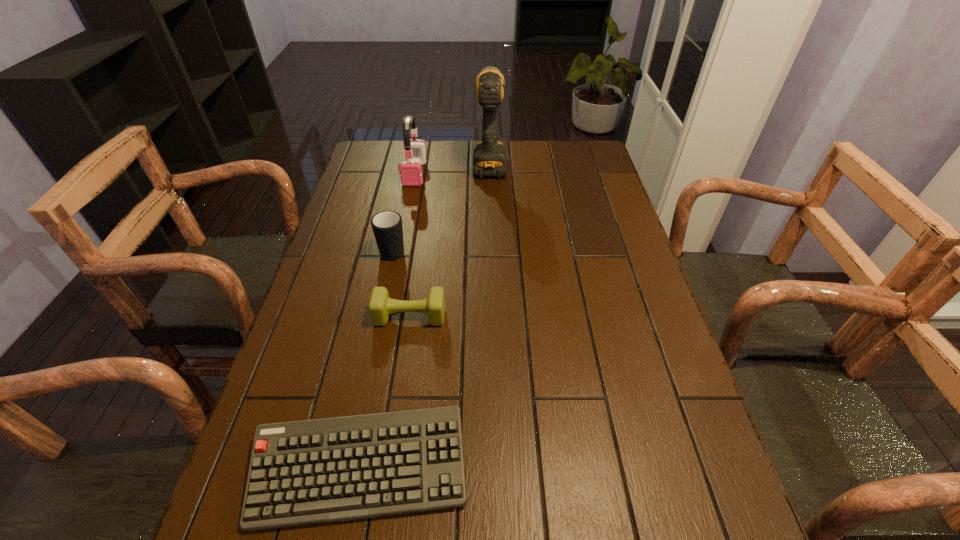
Locate an element on the screen. free space located on the side of the mug with the handle is located at coordinates (411, 165).

The image size is (960, 540). Identify the location of free spot located 0.320m on the side of the mug with the handle. (408, 177).

The image size is (960, 540). I want to click on vacant region located on the right of the fourth tallest object, so click(x=607, y=316).

This screenshot has height=540, width=960. I want to click on free space located on the right of the nearest object, so click(x=527, y=470).

You are a GUI agent. You are given a task and a screenshot of the screen. Output one action in this format:
    pyautogui.click(x=<x>, y=<y>)
    Task: Click on the drill positioned at the far edge
    The height and width of the screenshot is (540, 960).
    Given the screenshot: What is the action you would take?
    pyautogui.click(x=489, y=160)

What are the coordinates of `earphone present at the far edge` in the screenshot? It's located at (411, 173).

Locate an element on the screen. The image size is (960, 540). mug that is positioned at the left edge is located at coordinates (387, 227).

At what (x,y) coordinates should I click in order to perform the action: click on computer keyboard present at the left edge. Please return your answer as a coordinate pair (x, y). Looking at the image, I should click on (305, 472).

This screenshot has width=960, height=540. I want to click on vacant space at the left edge of the desktop, so click(369, 293).

Locate an element on the screen. Image resolution: width=960 pixels, height=540 pixels. blank space at the right edge is located at coordinates (663, 440).